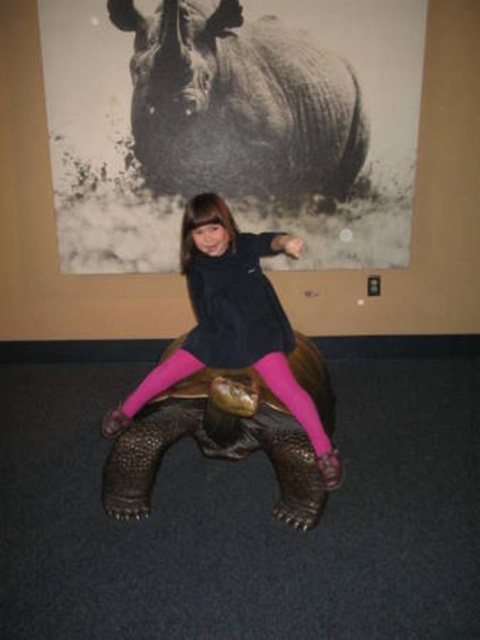
Does black textured rhinoceros at upper center appear on the right side of pink matte/tacky tights at center?

Correct, you'll find black textured rhinoceros at upper center to the right of pink matte/tacky tights at center.

Between point (299, 84) and point (247, 241), which one is positioned in front?

Point (247, 241) is more forward.

Locate an element on the screen. The height and width of the screenshot is (640, 480). black textured rhinoceros at upper center is located at coordinates (240, 106).

Can you confirm if black textured rhinoceros at upper center is positioned below leather-like tortoise at center?

No.

Which is in front, point (116, 16) or point (317, 472)?

Point (317, 472)

Find the location of a particular element. The image size is (480, 640). black textured rhinoceros at upper center is located at coordinates (240, 106).

Which is above, leather-like tortoise at center or pink matte/tacky tights at center?

pink matte/tacky tights at center

Does point (245, 394) come in front of point (199, 349)?

Yes, it is in front of point (199, 349).

Identify the location of leather-like tortoise at center. The width and height of the screenshot is (480, 640). (215, 442).